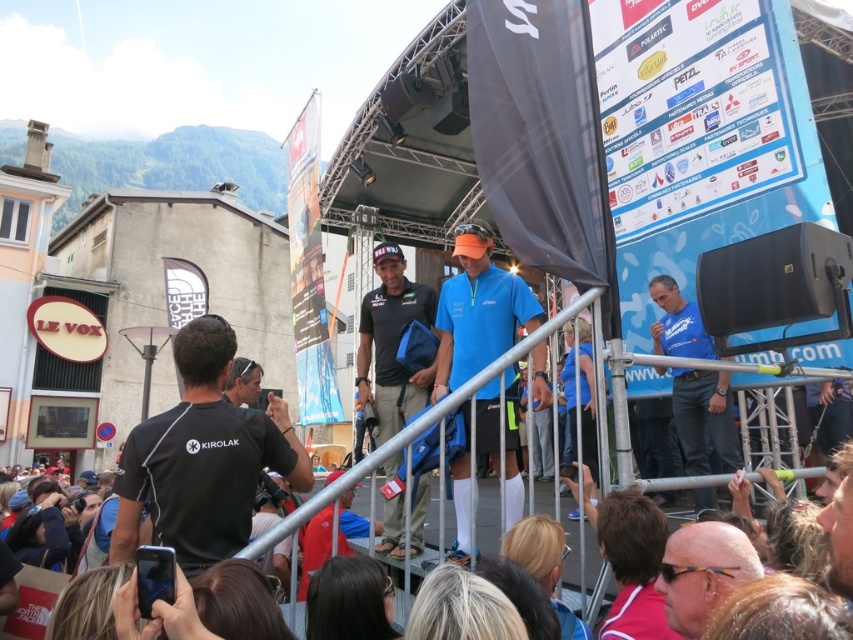
Question: Where is blue matte shirt at center located in relation to black matte shirt at lower left in the image?

Choices:
 (A) left
 (B) right

Answer: (B)

Question: Can you confirm if black fabric bag at center is positioned above black matte shirt at lower left?

Choices:
 (A) yes
 (B) no

Answer: (A)

Question: Which point is farther to the camera?

Choices:
 (A) (207, 388)
 (B) (691, 589)
 (C) (107, 611)
 (D) (711, 348)

Answer: (D)

Question: Is blue matte shirt at center to the right of blue fabric shirt at center from the viewer's perspective?

Choices:
 (A) no
 (B) yes

Answer: (A)

Question: Which point appears closest to the camera in this image?

Choices:
 (A) (x=683, y=337)
 (B) (x=271, y=461)
 (C) (x=503, y=296)

Answer: (B)

Question: Which object is the farthest from the matte black sunglasses at lower right?

Choices:
 (A) blue matte shirt at center
 (B) blue fabric shirt at center

Answer: (B)